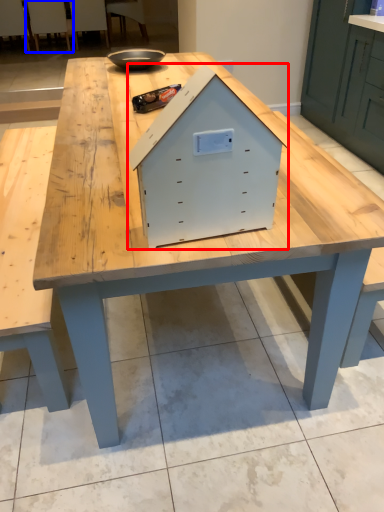
Question: Among these objects, which one is farthest to the camera, crate (highlighted by a red box) or chair (highlighted by a blue box)?

Choices:
 (A) crate
 (B) chair

Answer: (B)